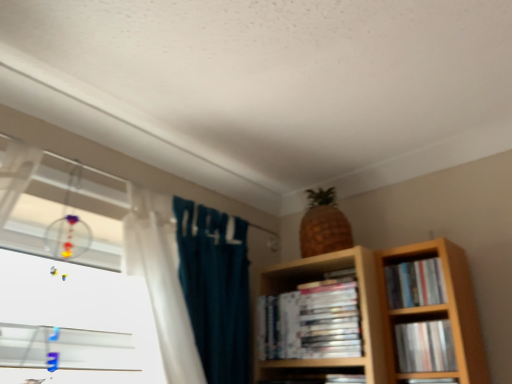
The image size is (512, 384). In order to click on matte plastic books at right, the first book in the right-to-left sequence in this screenshot , I will do `click(415, 283)`.

Based on the photo, what is the approximate width of matte plastic book at lower right, arranged as the 3th book when viewed from the left?

1.32 inches.

At what (x,y) coordinates should I click in order to perform the action: click on matte plastic books at right, which appears as the fourth book when viewed from the left. Please return your answer as a coordinate pair (x, y). The height and width of the screenshot is (384, 512). Looking at the image, I should click on (415, 283).

Locate an element on the screen. Image resolution: width=512 pixels, height=384 pixels. book in front of the matte plastic book at lower right, arranged as the 3th book when viewed from the left is located at coordinates (430, 381).

From the image's perspective, is matte black book at lower right, which appears as the third book when viewed from the right, located beneath matte plastic book at lower right, which is the second book in right-to-left order?

Yes, from the image's perspective, matte black book at lower right, which appears as the third book when viewed from the right, is below matte plastic book at lower right, which is the second book in right-to-left order.

From their relative heights in the image, would you say matte black book at lower right, the 2th book from the left, is taller or shorter than matte plastic book at lower right, which is the second book in right-to-left order?

In the image, matte black book at lower right, the 2th book from the left, appears to be taller than matte plastic book at lower right, which is the second book in right-to-left order.

Is matte plastic books at center, the first book viewed from the left, in front of or behind matte plastic books at right, which appears as the fourth book when viewed from the left, in the image?

Visually, matte plastic books at center, the first book viewed from the left, is located in front of matte plastic books at right, which appears as the fourth book when viewed from the left.

Considering the relative sizes of matte plastic books at center, which is the 4th book from right to left, and matte plastic books at right, the first book in the right-to-left sequence, in the image provided, is matte plastic books at center, which is the 4th book from right to left, thinner than matte plastic books at right, the first book in the right-to-left sequence,?

Incorrect, the width of matte plastic books at center, which is the 4th book from right to left, is not less than that of matte plastic books at right, the first book in the right-to-left sequence.

From the image's perspective, would you say matte plastic books at center, the first book viewed from the left, is positioned over matte plastic books at right, the first book in the right-to-left sequence?

Incorrect, from the image's perspective, matte plastic books at center, the first book viewed from the left, is lower than matte plastic books at right, the first book in the right-to-left sequence.

In the scene shown: Could matte plastic books at right, which appears as the fourth book when viewed from the left, be considered to be inside matte plastic books at center, which is the 4th book from right to left?

That's incorrect, matte plastic books at right, which appears as the fourth book when viewed from the left, is not inside matte plastic books at center, which is the 4th book from right to left.

Can you confirm if matte plastic books at center, the first book viewed from the left, is positioned to the left of matte black book at lower right, the 2th book from the left?

Yes, matte plastic books at center, the first book viewed from the left, is to the left of matte black book at lower right, the 2th book from the left.

Are matte plastic books at center, the first book viewed from the left, and matte black book at lower right, the 2th book from the left, making contact?

matte plastic books at center, the first book viewed from the left, and matte black book at lower right, the 2th book from the left, are not in contact.

Is matte plastic books at center, the first book viewed from the left, closer to the viewer compared to matte black book at lower right, which appears as the third book when viewed from the right?

No, matte plastic books at center, the first book viewed from the left, is further to the viewer.

Is matte plastic books at center, which is the 4th book from right to left, aimed at matte black book at lower right, the 2th book from the left?

No, matte plastic books at center, which is the 4th book from right to left, is not aimed at matte black book at lower right, the 2th book from the left.

From a real-world perspective, which is physically above, matte plastic books at center, the first book viewed from the left, or matte plastic book at lower right, arranged as the 3th book when viewed from the left?

From a 3D spatial view, matte plastic books at center, the first book viewed from the left, is above.

Is matte plastic books at center, the first book viewed from the left, directly adjacent to matte plastic book at lower right, which is the second book in right-to-left order?

No, matte plastic books at center, the first book viewed from the left, is not beside matte plastic book at lower right, which is the second book in right-to-left order.

The image size is (512, 384). I want to click on the 2nd book to the right of the matte plastic books at center, which is the 4th book from right to left, starting your count from the anchor, so click(x=425, y=346).

From the image's perspective, relative to matte plastic books at right, the first book in the right-to-left sequence, is matte plastic book at lower right, arranged as the 3th book when viewed from the left, above or below?

matte plastic book at lower right, arranged as the 3th book when viewed from the left, is below matte plastic books at right, the first book in the right-to-left sequence.

Which object is positioned more to the right, matte plastic book at lower right, arranged as the 3th book when viewed from the left, or matte plastic books at right, which appears as the fourth book when viewed from the left?

matte plastic books at right, which appears as the fourth book when viewed from the left.

Between point (441, 336) and point (398, 290), which one is positioned behind?

Point (398, 290)

How many degrees apart are the facing directions of matte plastic book at lower right, which is the second book in right-to-left order, and matte plastic books at right, which appears as the fourth book when viewed from the left?

The angle between the facing direction of matte plastic book at lower right, which is the second book in right-to-left order, and the facing direction of matte plastic books at right, which appears as the fourth book when viewed from the left, is 2.84 degrees.

Does matte plastic books at right, the first book in the right-to-left sequence, come in front of matte plastic book at lower right, which is the second book in right-to-left order?

No, it is not.

Based on their sizes in the image, would you say matte plastic books at right, the first book in the right-to-left sequence, is bigger or smaller than matte plastic book at lower right, which is the second book in right-to-left order?

Considering their sizes, matte plastic books at right, the first book in the right-to-left sequence, takes up less space than matte plastic book at lower right, which is the second book in right-to-left order.

Can you confirm if matte plastic books at right, which appears as the fourth book when viewed from the left, is shorter than matte plastic book at lower right, which is the second book in right-to-left order?

Correct, matte plastic books at right, which appears as the fourth book when viewed from the left, is not as tall as matte plastic book at lower right, which is the second book in right-to-left order.

In the scene shown: Is matte plastic books at right, the first book in the right-to-left sequence, wider than matte plastic book at lower right, arranged as the 3th book when viewed from the left?

In fact, matte plastic books at right, the first book in the right-to-left sequence, might be narrower than matte plastic book at lower right, arranged as the 3th book when viewed from the left.

From a real-world perspective, is matte plastic books at right, the first book in the right-to-left sequence, positioned above or below matte black book at lower right, the 2th book from the left?

Clearly, from a real-world perspective, matte plastic books at right, the first book in the right-to-left sequence, is above matte black book at lower right, the 2th book from the left.

Is matte plastic books at right, which appears as the fourth book when viewed from the left, taller or shorter than matte black book at lower right, the 2th book from the left?

Clearly, matte plastic books at right, which appears as the fourth book when viewed from the left, is shorter compared to matte black book at lower right, the 2th book from the left.

In the scene shown: Which object is wider, matte plastic books at right, which appears as the fourth book when viewed from the left, or matte black book at lower right, the 2th book from the left?

Wider between the two is matte black book at lower right, the 2th book from the left.

Is point (419, 277) positioned before point (431, 379)?

No, (419, 277) is behind (431, 379).

Identify the location of the 1st book to the right of the matte black book at lower right, which appears as the third book when viewed from the right, starting your count from the anchor. (425, 346).

From a real-world perspective, starting from the matte plastic books at right, the first book in the right-to-left sequence, which book is the 1st one below it? Please provide its 2D coordinates.

[(312, 320)]

Based on their spatial positions, is matte black book at lower right, the 2th book from the left, or matte plastic book at lower right, arranged as the 3th book when viewed from the left, closer to matte plastic books at center, which is the 4th book from right to left?

matte plastic book at lower right, arranged as the 3th book when viewed from the left.

When comparing their distances from matte plastic books at center, which is the 4th book from right to left, does matte plastic book at lower right, which is the second book in right-to-left order, or matte black book at lower right, which appears as the third book when viewed from the right, seem closer?

Based on the image, matte plastic book at lower right, which is the second book in right-to-left order, appears to be nearer to matte plastic books at center, which is the 4th book from right to left.

Consider the image. Considering their positions, is matte plastic books at right, the first book in the right-to-left sequence, positioned further to matte plastic books at center, which is the 4th book from right to left, than matte plastic book at lower right, which is the second book in right-to-left order?

Based on the image, matte plastic book at lower right, which is the second book in right-to-left order, appears to be further to matte plastic books at center, which is the 4th book from right to left.

Estimate the real-world distances between objects in this image. Which object is further from matte plastic books at center, the first book viewed from the left, matte plastic books at right, the first book in the right-to-left sequence, or matte black book at lower right, the 2th book from the left?

Among the two, matte black book at lower right, the 2th book from the left, is located further to matte plastic books at center, the first book viewed from the left.

Considering their positions, is matte plastic books at right, which appears as the fourth book when viewed from the left, positioned further to matte plastic book at lower right, arranged as the 3th book when viewed from the left, than matte black book at lower right, the 2th book from the left?

matte plastic books at right, which appears as the fourth book when viewed from the left.

In the scene shown: Based on their spatial positions, is matte black book at lower right, which appears as the third book when viewed from the right, or matte plastic book at lower right, which is the second book in right-to-left order, further from matte plastic books at right, which appears as the fourth book when viewed from the left?

Based on the image, matte black book at lower right, which appears as the third book when viewed from the right, appears to be further to matte plastic books at right, which appears as the fourth book when viewed from the left.

Looking at this image, which object lies further to the anchor point matte black book at lower right, the 2th book from the left, matte plastic book at lower right, which is the second book in right-to-left order, or matte plastic books at right, which appears as the fourth book when viewed from the left?

matte plastic books at right, which appears as the fourth book when viewed from the left, lies further to matte black book at lower right, the 2th book from the left, than the other object.

Looking at the image, which one is located further to matte black book at lower right, the 2th book from the left, matte plastic books at right, the first book in the right-to-left sequence, or matte plastic book at lower right, which is the second book in right-to-left order?

matte plastic books at right, the first book in the right-to-left sequence.

The image size is (512, 384). Find the location of `book between matte plastic books at center, the first book viewed from the left, and matte plastic book at lower right, which is the second book in right-to-left order`. book between matte plastic books at center, the first book viewed from the left, and matte plastic book at lower right, which is the second book in right-to-left order is located at coordinates (430, 381).